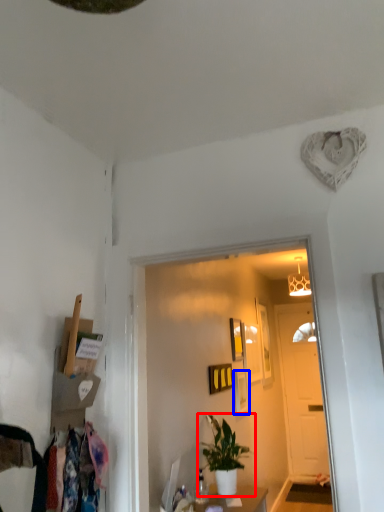
Question: Which point is closer to the camera, houseplant (highlighted by a red box) or picture frame (highlighted by a blue box)?

Choices:
 (A) houseplant
 (B) picture frame

Answer: (A)